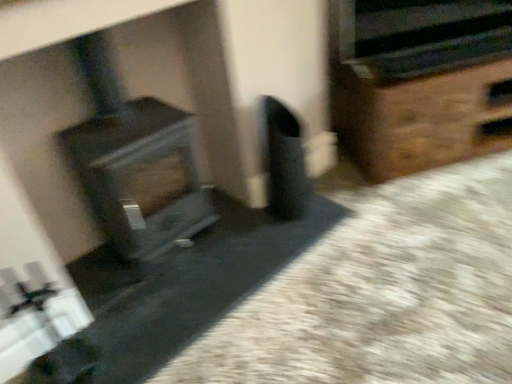
Question: From a real-world perspective, does metallic silver stereo at upper right sit lower than wood grain stove at left?

Choices:
 (A) no
 (B) yes

Answer: (A)

Question: Can you confirm if metallic silver stereo at upper right is positioned to the right of wood grain stove at left?

Choices:
 (A) yes
 (B) no

Answer: (A)

Question: Can you confirm if metallic silver stereo at upper right is wider than wood grain stove at left?

Choices:
 (A) no
 (B) yes

Answer: (A)

Question: From the image's perspective, does metallic silver stereo at upper right appear lower than wood grain stove at left?

Choices:
 (A) yes
 (B) no

Answer: (B)

Question: Is metallic silver stereo at upper right next to wood grain stove at left and touching it?

Choices:
 (A) no
 (B) yes

Answer: (A)

Question: Can you confirm if metallic silver stereo at upper right is shorter than wood grain stove at left?

Choices:
 (A) no
 (B) yes

Answer: (B)

Question: Is metallic silver stereo at upper right not within brown wooden chest at right?

Choices:
 (A) no
 (B) yes

Answer: (B)

Question: Is metallic silver stereo at upper right further to the viewer compared to brown wooden chest at right?

Choices:
 (A) yes
 (B) no

Answer: (B)

Question: Is metallic silver stereo at upper right wider than brown wooden chest at right?

Choices:
 (A) no
 (B) yes

Answer: (A)

Question: Is metallic silver stereo at upper right taller than brown wooden chest at right?

Choices:
 (A) yes
 (B) no

Answer: (B)

Question: From the image's perspective, does metallic silver stereo at upper right appear higher than brown wooden chest at right?

Choices:
 (A) yes
 (B) no

Answer: (A)

Question: Can you confirm if metallic silver stereo at upper right is bigger than brown wooden chest at right?

Choices:
 (A) no
 (B) yes

Answer: (A)

Question: From a real-world perspective, is wood grain stove at left on metallic silver stereo at upper right?

Choices:
 (A) no
 (B) yes

Answer: (A)